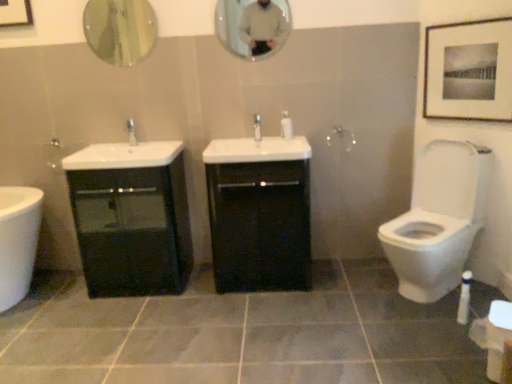
This screenshot has height=384, width=512. Find the location of `free point in front of black glossy cabinet at center, the first bathroom cabinet when ordered from right to left`. free point in front of black glossy cabinet at center, the first bathroom cabinet when ordered from right to left is located at coordinates (261, 318).